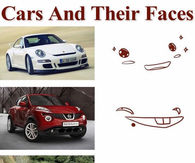
The height and width of the screenshot is (163, 195). Find the location of `side window`. side window is located at coordinates (18, 42), (24, 99).